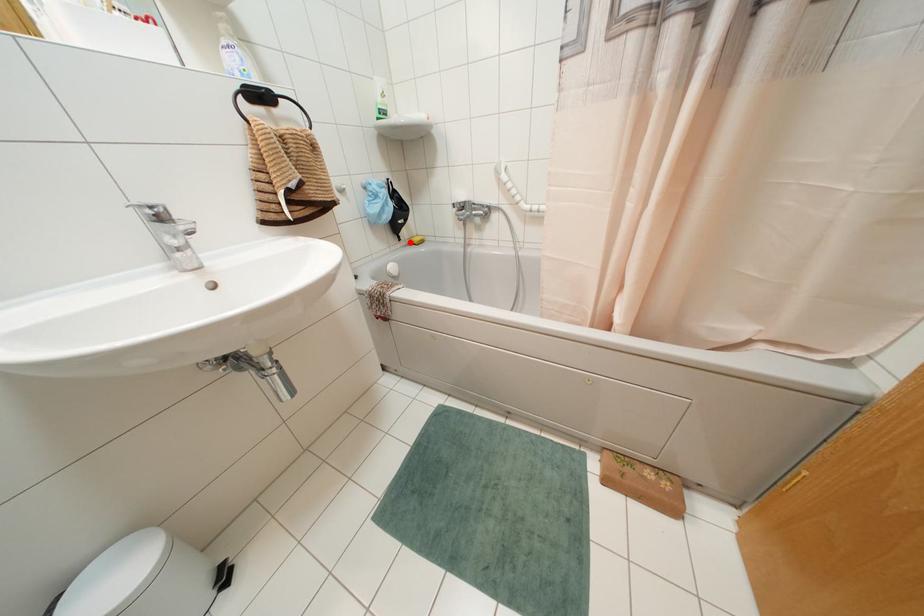
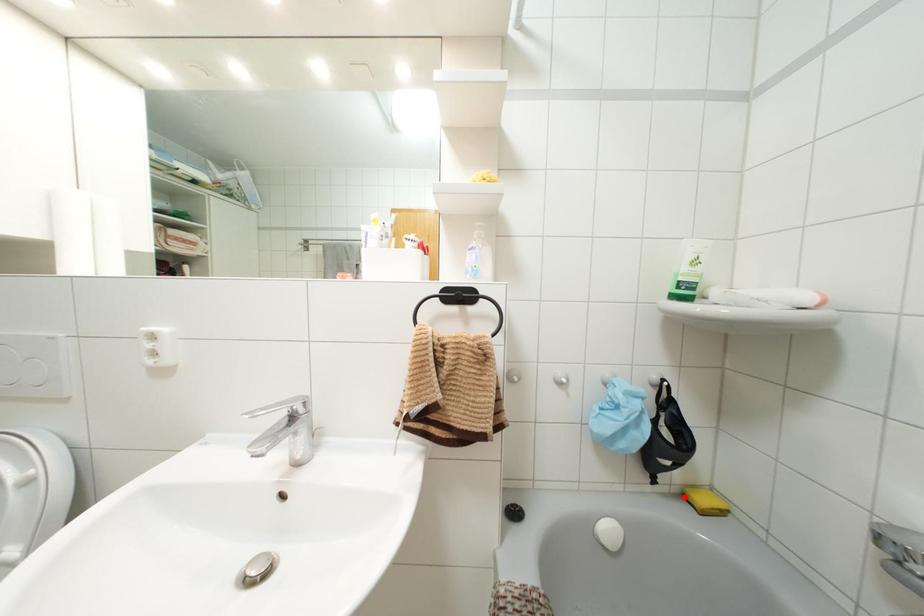
I am providing you with two images of the same scene from different viewpoints. A red point is marked on the first image and another point is marked on the second image. Does the point marked in image1 correspond to the same location as the one in image2?

Yes